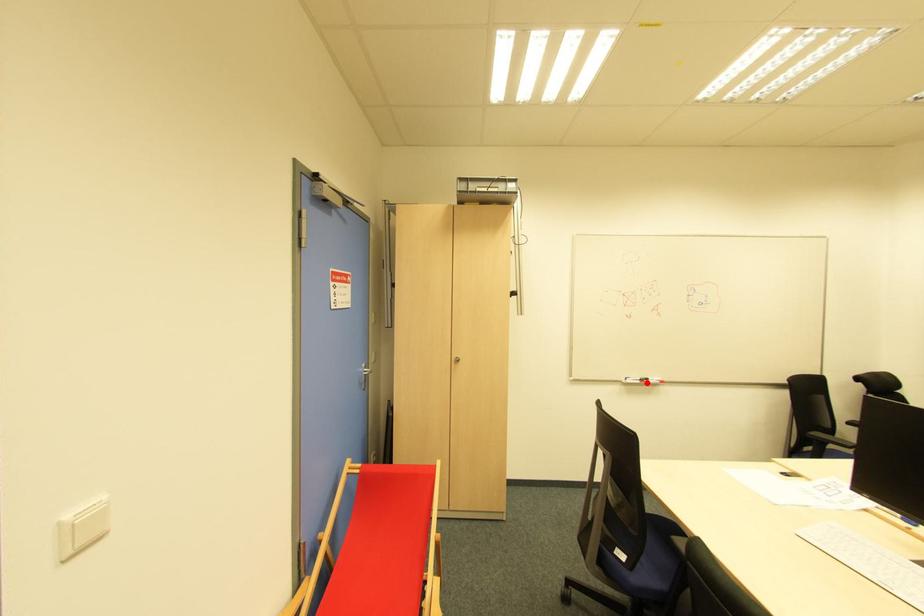
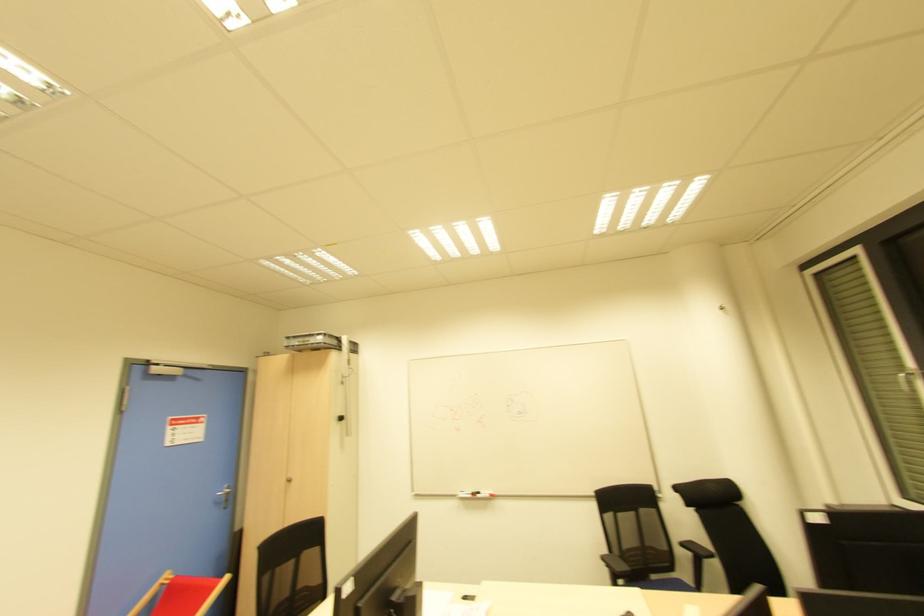
Locate, in the second image, the point that corresponds to the highlighted location in the first image.

(478, 496)